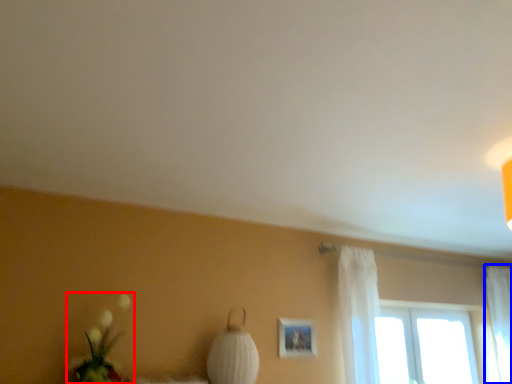
Question: Which point is further to the camera, floral arrangement (highlighted by a red box) or curtain (highlighted by a blue box)?

Choices:
 (A) floral arrangement
 (B) curtain

Answer: (B)